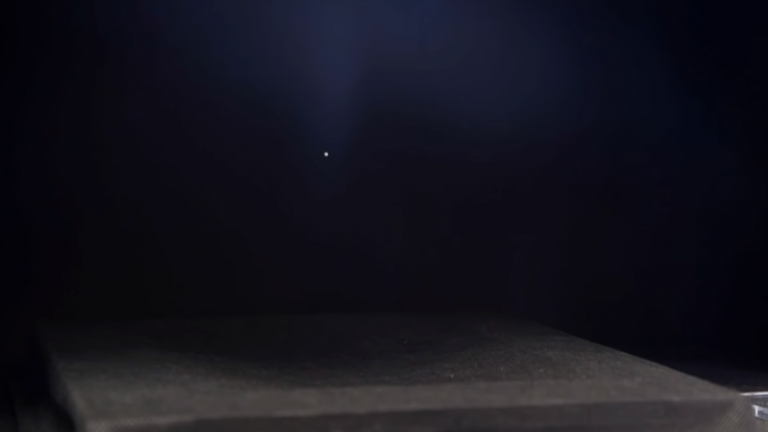
Image resolution: width=768 pixels, height=432 pixels. I want to click on light spots in background, so click(313, 52), click(342, 40), click(419, 52).